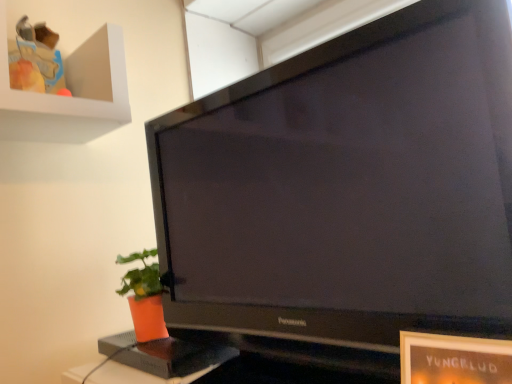
Identify the location of orange matte pot at lower left. (144, 296).

The height and width of the screenshot is (384, 512). What do you see at coordinates (144, 296) in the screenshot?
I see `orange matte pot at lower left` at bounding box center [144, 296].

In order to click on black glossy television at center in this screenshot , I will do (x=347, y=187).

Measure the distance between black glossy television at center and camera.

black glossy television at center and camera are 23.29 inches apart.

What is the approximate width of black glossy television at center?

It is 10.04 inches.

The width and height of the screenshot is (512, 384). What do you see at coordinates (347, 187) in the screenshot? I see `black glossy television at center` at bounding box center [347, 187].

This screenshot has height=384, width=512. In order to click on orange matte pot at lower left in this screenshot , I will do `click(144, 296)`.

Is black glossy television at center to the left or to the right of orange matte pot at lower left in the image?

A: black glossy television at center is positioned on orange matte pot at lower left's right side.

Is the depth of black glossy television at center less than that of orange matte pot at lower left?

Yes, black glossy television at center is closer to the viewer.

Does point (187, 276) come closer to viewer compared to point (152, 263)?

That is True.

From the image's perspective, who appears lower, black glossy television at center or orange matte pot at lower left?

orange matte pot at lower left.

From a real-world perspective, is black glossy television at center physically below orange matte pot at lower left?

No.

Based on the photo, considering the relative sizes of black glossy television at center and orange matte pot at lower left in the image provided, is black glossy television at center thinner than orange matte pot at lower left?

No.

Considering the sizes of objects black glossy television at center and orange matte pot at lower left in the image provided, who is taller, black glossy television at center or orange matte pot at lower left?

black glossy television at center is taller.

Who is smaller, black glossy television at center or orange matte pot at lower left?

orange matte pot at lower left.

Consider the image. Is black glossy television at center situated inside orange matte pot at lower left or outside?

black glossy television at center is not enclosed by orange matte pot at lower left.

Are black glossy television at center and orange matte pot at lower left located far from each other?

No.

Is black glossy television at center facing towards orange matte pot at lower left?

No, black glossy television at center is not oriented towards orange matte pot at lower left.

Measure the distance from black glossy television at center to orange matte pot at lower left.

black glossy television at center is 16.84 inches away from orange matte pot at lower left.

Find the location of a particular element. The width and height of the screenshot is (512, 384). houseplant on the left of black glossy television at center is located at coordinates (144, 296).

Which object is positioned more to the left, orange matte pot at lower left or black glossy television at center?

From the viewer's perspective, orange matte pot at lower left appears more on the left side.

Which is in front, orange matte pot at lower left or black glossy television at center?

black glossy television at center.

Which is in front, point (135, 302) or point (207, 98)?

The point (207, 98) is closer.

From the image's perspective, which one is positioned higher, orange matte pot at lower left or black glossy television at center?

From the image's view, black glossy television at center is above.

From a real-world perspective, who is located higher, orange matte pot at lower left or black glossy television at center?

black glossy television at center.

Which of these two, orange matte pot at lower left or black glossy television at center, is wider?

With larger width is black glossy television at center.

Does orange matte pot at lower left have a lesser height compared to black glossy television at center?

Correct, orange matte pot at lower left is not as tall as black glossy television at center.

Can you confirm if orange matte pot at lower left is smaller than black glossy television at center?

Correct, orange matte pot at lower left occupies less space than black glossy television at center.

Choose the correct answer: Is orange matte pot at lower left inside black glossy television at center or outside it?

orange matte pot at lower left cannot be found inside black glossy television at center.

Based on the photo, is orange matte pot at lower left far from black glossy television at center?

That's not correct — orange matte pot at lower left is a little close to black glossy television at center.

Is orange matte pot at lower left turned away from black glossy television at center?

No, orange matte pot at lower left's orientation is not away from black glossy television at center.

Where is `television in front of the orange matte pot at lower left`? The image size is (512, 384). television in front of the orange matte pot at lower left is located at coordinates point(347,187).

The width and height of the screenshot is (512, 384). In order to click on television that is above the orange matte pot at lower left (from a real-world perspective) in this screenshot , I will do `click(347, 187)`.

Where is `television on the right of orange matte pot at lower left`? television on the right of orange matte pot at lower left is located at coordinates coord(347,187).